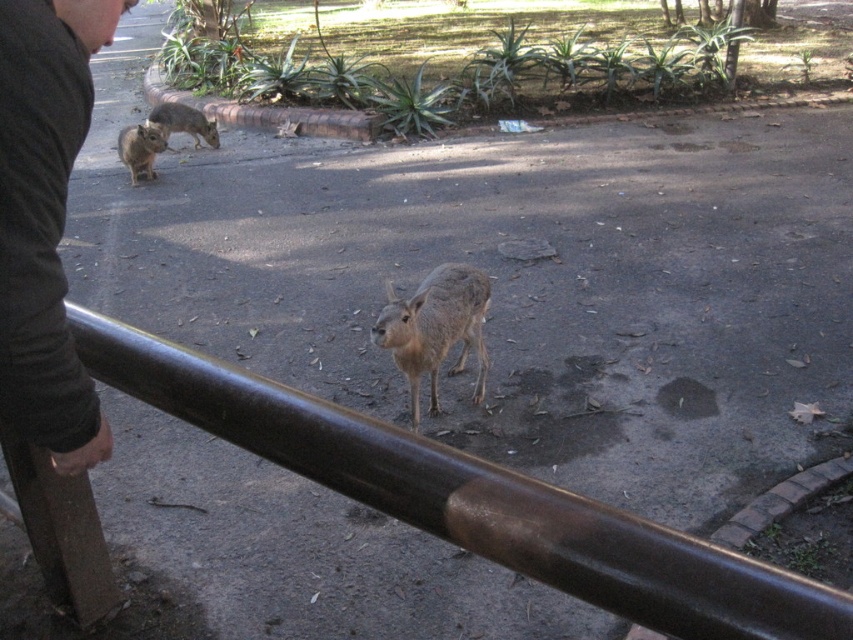
Is point (157, 125) positioned after point (129, 141)?

Yes.

Is furry gray rabbit at upper left wider than brown furry rodent at left?

Correct, the width of furry gray rabbit at upper left exceeds that of brown furry rodent at left.

Describe the element at coordinates (183, 122) in the screenshot. The image size is (853, 640). I see `furry gray rabbit at upper left` at that location.

The image size is (853, 640). Identify the location of furry gray rabbit at upper left. (183, 122).

Which is more to the right, black fabric at left or brown furry rodent at left?

black fabric at left is more to the right.

The image size is (853, 640). Describe the element at coordinates (45, 220) in the screenshot. I see `black fabric at left` at that location.

At what (x,y) coordinates should I click in order to perform the action: click on black fabric at left. Please return your answer as a coordinate pair (x, y). This screenshot has height=640, width=853. Looking at the image, I should click on (45, 220).

Is fur-like gray animal at center in front of brown furry rodent at left?

Yes, fur-like gray animal at center is in front of brown furry rodent at left.

Where is `fur-like gray animal at center`? This screenshot has width=853, height=640. fur-like gray animal at center is located at coordinates (434, 330).